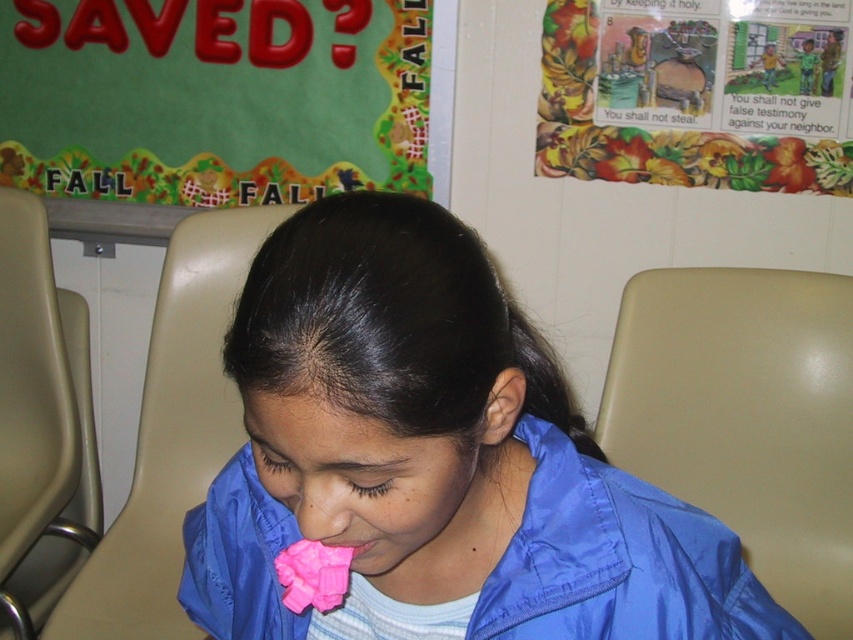
You are an interior designer planning to hang a new decoration in the classroom. The point at coordinates (440, 454) marks the location of a pink matte paper at center. Where should you place the decoration to avoid covering the pink matte paper at center?

To avoid covering the pink matte paper at center, place the decoration away from the coordinates (440, 454) where the pink matte paper is located.

You are an interior designer planning to hang a large poster in the classroom. The poster is wider than the beige plastic chair at right. Can you hang the poster on the green fabric bulletin board at upper left without it exceeding the board?

The green fabric bulletin board at upper left has a larger width than the beige plastic chair at right. Since the poster is wider than the beige plastic chair at right, it might still fit on the bulletin board if the board is sufficiently wide. However, without knowing the exact dimensions of the poster, it is difficult to confirm. Please ensure the poster does not exceed the board.